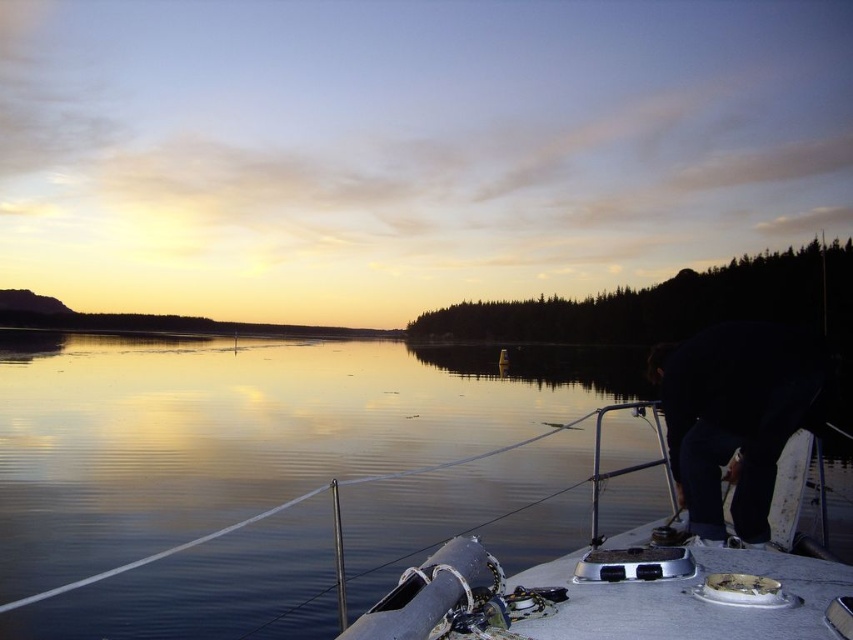
You are standing on the deck of the boat and want to walk towards the water to take a photo. Since the deck is narrow, you need to know which area is wider between the glossy reflective water at center and the metallic gray boat at lower right. Which one is wider?

The glossy reflective water at center is wider than the metallic gray boat at lower right, so the water area is wider.

Consider the image. You are standing on the deck of the boat and want to place a 20 inch long fishing rod between the metallic gray boat at lower right and the dark blue jeans at lower right. Can the fishing rod fit in the space between them?

The space between the metallic gray boat at lower right and the dark blue jeans at lower right is 22.53 inches. Since the fishing rod is 20 inches long, it can fit in the space between them as there is enough room.

You are standing on the deck of the boat and want to take a photo of the sunset. Where should you position yourself to ensure both the glossy reflective water at center and the metallic gray boat at lower right are visible in the frame?

You should position yourself to the right side of the metallic gray boat at lower right so that the glossy reflective water at center, which is on the left side of the boat, will be in the frame along with the boat itself.